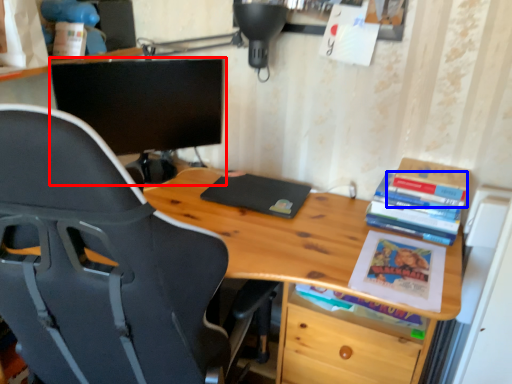
Question: Among these objects, which one is farthest to the camera, computer monitor (highlighted by a red box) or book (highlighted by a blue box)?

Choices:
 (A) computer monitor
 (B) book

Answer: (A)